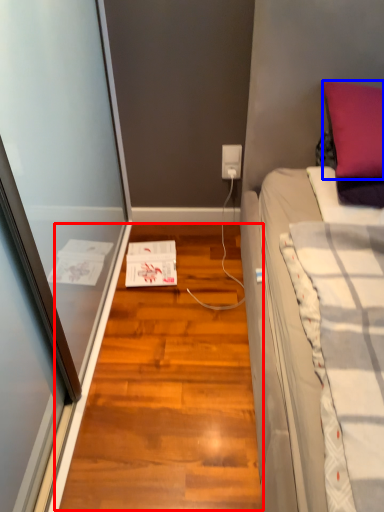
Question: Which object appears closest to the camera in this image, hardwood (highlighted by a red box) or pillow (highlighted by a blue box)?

Choices:
 (A) hardwood
 (B) pillow

Answer: (A)